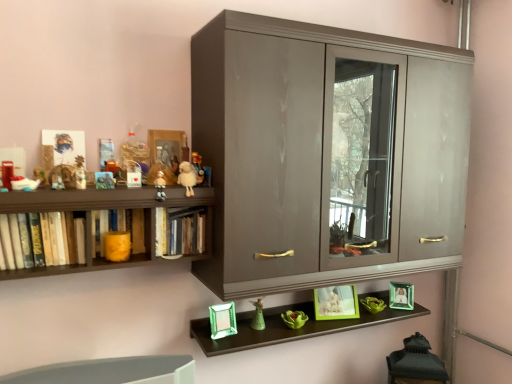
Question: Is green glass photo frame at lower right, positioned as the first picture frame in right-to-left order, at the left side of glossy wood cupboard at center?

Choices:
 (A) no
 (B) yes

Answer: (A)

Question: From the image's perspective, does green glass photo frame at lower right, which is the third picture frame in left-to-right order, appear higher than glossy wood cupboard at center?

Choices:
 (A) yes
 (B) no

Answer: (B)

Question: From a real-world perspective, is green glass photo frame at lower right, which is the third picture frame in left-to-right order, beneath glossy wood cupboard at center?

Choices:
 (A) yes
 (B) no

Answer: (A)

Question: Is green glass photo frame at lower right, positioned as the first picture frame in right-to-left order, looking in the opposite direction of glossy wood cupboard at center?

Choices:
 (A) yes
 (B) no

Answer: (B)

Question: From a real-world perspective, is green glass photo frame at lower right, placed as the 3th picture frame when sorted from top to bottom, over glossy wood cupboard at center?

Choices:
 (A) no
 (B) yes

Answer: (A)

Question: From a real-world perspective, is hardcover books at left, positioned as the third book in right-to-left order, above or below fluffy white lamb at upper center, the fourth toy when ordered from front to back?

Choices:
 (A) above
 (B) below

Answer: (B)

Question: Is hardcover books at left, positioned as the third book in right-to-left order, wider or thinner than fluffy white lamb at upper center, marked as the 3th toy in a right-to-left arrangement?

Choices:
 (A) thin
 (B) wide

Answer: (B)

Question: Based on their sizes in the image, would you say hardcover books at left, positioned as the third book in right-to-left order, is bigger or smaller than fluffy white lamb at upper center, marked as the 3th toy in a right-to-left arrangement?

Choices:
 (A) big
 (B) small

Answer: (A)

Question: Considering the positions of hardcover books at left, marked as the 1th book in a left-to-right arrangement, and fluffy white lamb at upper center, which is the 4th toy from back to front, in the image, is hardcover books at left, marked as the 1th book in a left-to-right arrangement, taller or shorter than fluffy white lamb at upper center, which is the 4th toy from back to front,?

Choices:
 (A) short
 (B) tall

Answer: (B)

Question: From the image's perspective, relative to glossy wood cupboard at center, is hardcover books at left, positioned as the third book in right-to-left order, above or below?

Choices:
 (A) above
 (B) below

Answer: (B)

Question: Choose the correct answer: Is hardcover books at left, marked as the 1th book in a left-to-right arrangement, inside glossy wood cupboard at center or outside it?

Choices:
 (A) outside
 (B) inside

Answer: (A)

Question: From a real-world perspective, is hardcover books at left, positioned as the third book in right-to-left order, above or below glossy wood cupboard at center?

Choices:
 (A) below
 (B) above

Answer: (A)

Question: Looking at the image, does hardcover books at left, positioned as the third book in right-to-left order, seem bigger or smaller compared to glossy wood cupboard at center?

Choices:
 (A) small
 (B) big

Answer: (A)

Question: In the image, is green matte figurine at center, the seventh toy when ordered from front to back, on the left side or the right side of matte plastic toy at upper left, the 6th toy when ordered from right to left?

Choices:
 (A) right
 (B) left

Answer: (A)

Question: Which is correct: green matte figurine at center, placed as the 1th toy when sorted from back to front, is inside matte plastic toy at upper left, arranged as the fifth toy when viewed from the front, or outside of it?

Choices:
 (A) outside
 (B) inside

Answer: (A)